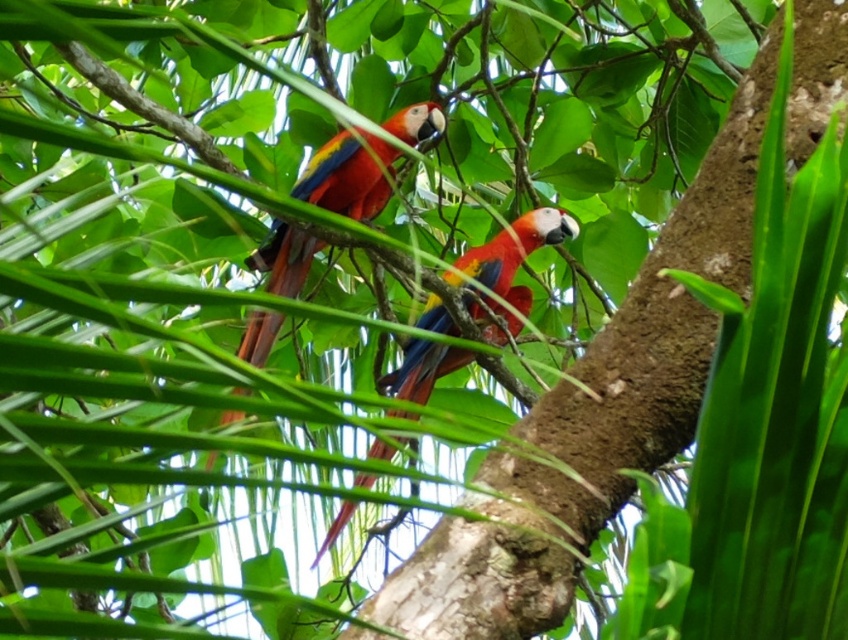
You are a birdwatcher observing two parrots in a tropical forest. You notice a glossy feathers parrot at center and a shiny multicolored parrot at center. Which parrot is located to the left when viewed from your perspective?

The glossy feathers parrot at center is positioned on the left side of the shiny multicolored parrot at center, so it is the one located to the left.

You are a birdwatcher observing two parrots in a tropical forest. You see a glossy feathers parrot at center and a shiny multicolored parrot at center. Which one is positioned higher in the tree branches?

The glossy feathers parrot at center is positioned higher than the shiny multicolored parrot at center.

You are a photographer trying to capture the glossy feathers of the parrot at center. The camera you are using has a focus point at coordinate point (343,179). Will this focus point help you capture the glossy feathers of the parrot at center?

Yes, the focus point at point (343,179) is exactly where the glossy feathers parrot at center is located, so it will help capture the detail.